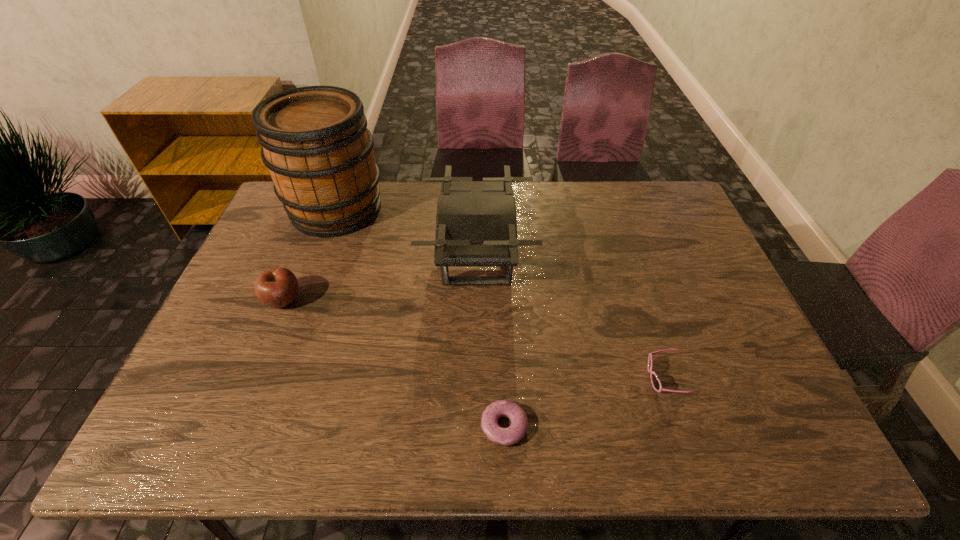
This screenshot has width=960, height=540. I want to click on cider, so click(315, 142).

Where is `drone`? drone is located at coordinates (476, 225).

At what (x,y) coordinates should I click in order to perform the action: click on apple. Please return your answer as a coordinate pair (x, y). Looking at the image, I should click on (278, 287).

Find the location of `the second shortest object`. the second shortest object is located at coordinates (656, 383).

The width and height of the screenshot is (960, 540). I want to click on the rightmost object, so click(x=656, y=383).

The image size is (960, 540). In order to click on doughnut in this screenshot , I will do `click(516, 431)`.

Locate an element on the screen. Image resolution: width=960 pixels, height=540 pixels. the shortest object is located at coordinates (516, 431).

At what (x,y) coordinates should I click in order to perform the action: click on free space located 0.160m on the right of the tallest object. Please return your answer as a coordinate pair (x, y). Looking at the image, I should click on (431, 209).

The image size is (960, 540). I want to click on free space located with a camera mounted on the underside of the drone, so click(588, 256).

In order to click on blank space located on the side of the third tallest object with the unique marking in this screenshot , I will do `click(396, 300)`.